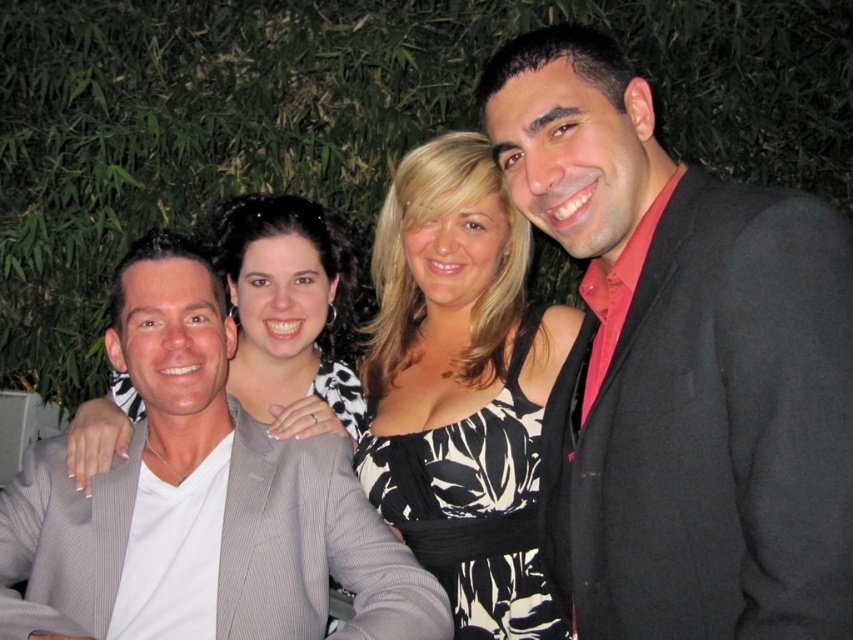
Question: Which of the following is the farthest from the observer?

Choices:
 (A) (788, 496)
 (B) (428, 502)
 (C) (241, 483)

Answer: (B)

Question: Can you confirm if black matte suit at right is wider than black printed dress at center?

Choices:
 (A) yes
 (B) no

Answer: (B)

Question: Can you confirm if black matte suit at right is positioned to the left of black printed dress at center?

Choices:
 (A) yes
 (B) no

Answer: (B)

Question: Which object is positioned closest to the gray pinstripe suit at left?

Choices:
 (A) black printed dress at center
 (B) black matte suit at right

Answer: (A)

Question: Which of the following is the farthest from the observer?

Choices:
 (A) black printed dress at center
 (B) gray pinstripe suit at left

Answer: (A)

Question: Considering the relative positions of gray pinstripe suit at left and black printed dress at center in the image provided, where is gray pinstripe suit at left located with respect to black printed dress at center?

Choices:
 (A) below
 (B) above

Answer: (A)